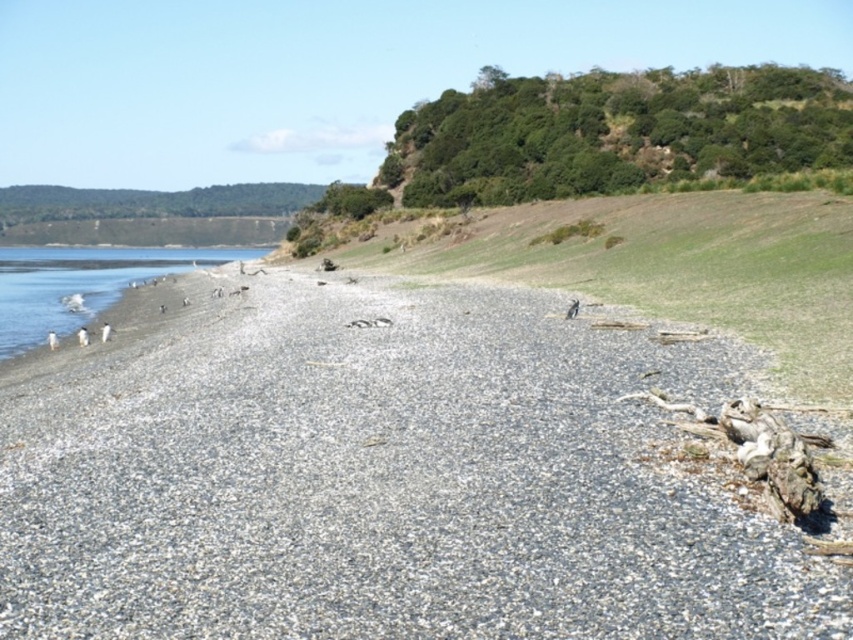
Question: From the image, what is the correct spatial relationship of gray gravelly sand at lower left in relation to white sand at lower left?

Choices:
 (A) below
 (B) above

Answer: (A)

Question: Which of the following is the closest to the observer?

Choices:
 (A) white sand at lower left
 (B) gray gravelly sand at lower left

Answer: (B)

Question: Can you confirm if gray gravelly sand at lower left is thinner than white sand at lower left?

Choices:
 (A) no
 (B) yes

Answer: (B)

Question: Can you confirm if gray gravelly sand at lower left is thinner than white sand at lower left?

Choices:
 (A) no
 (B) yes

Answer: (B)

Question: Which point appears closest to the camera in this image?

Choices:
 (A) click(701, 563)
 (B) click(158, 253)

Answer: (A)